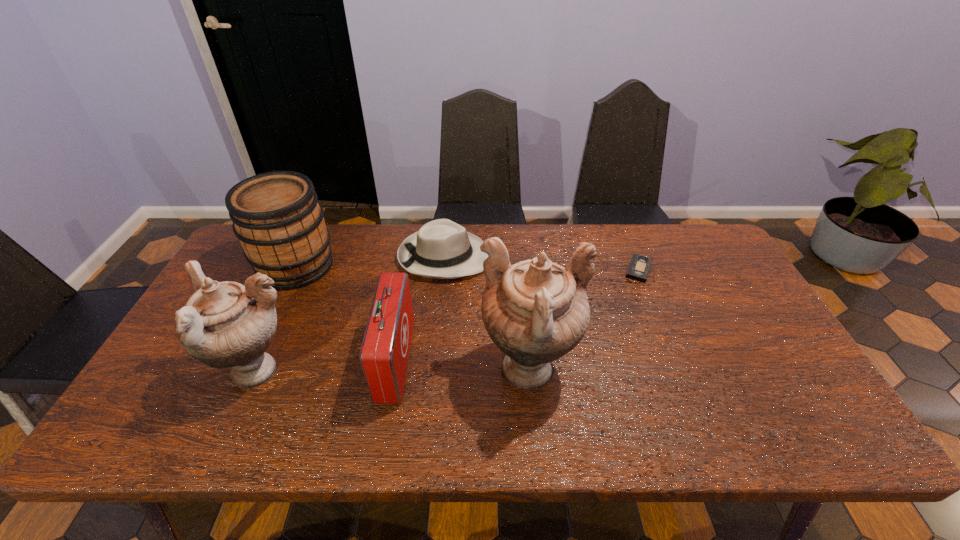
The width and height of the screenshot is (960, 540). What are the coordinates of `the left urn` in the screenshot? It's located at (226, 324).

Where is `the taller urn`? The width and height of the screenshot is (960, 540). the taller urn is located at coordinates (535, 311).

Where is `the right urn`? The height and width of the screenshot is (540, 960). the right urn is located at coordinates (535, 311).

Locate an element on the screen. cider is located at coordinates (276, 216).

You are a GUI agent. You are given a task and a screenshot of the screen. Output one action in this format:
    pyautogui.click(x=<x>, y=<y>)
    Task: Click on the fedora
    This screenshot has width=960, height=540.
    Given the screenshot: What is the action you would take?
    pos(442,249)

At what (x,y) coordinates should I click in order to perform the action: click on the shortest object. Please return your answer as a coordinate pair (x, y). The height and width of the screenshot is (540, 960). Looking at the image, I should click on (639, 267).

At what (x,y) coordinates should I click in order to perform the action: click on the rightmost object. Please return your answer as a coordinate pair (x, y). This screenshot has height=540, width=960. Looking at the image, I should click on (639, 267).

The image size is (960, 540). What are the coordinates of `the first-aid kit` in the screenshot? It's located at (384, 353).

This screenshot has height=540, width=960. I want to click on vacant region located 0.360m on the right of the left urn, so click(445, 373).

The image size is (960, 540). Identify the location of free space located on the right of the right urn. (x=641, y=372).